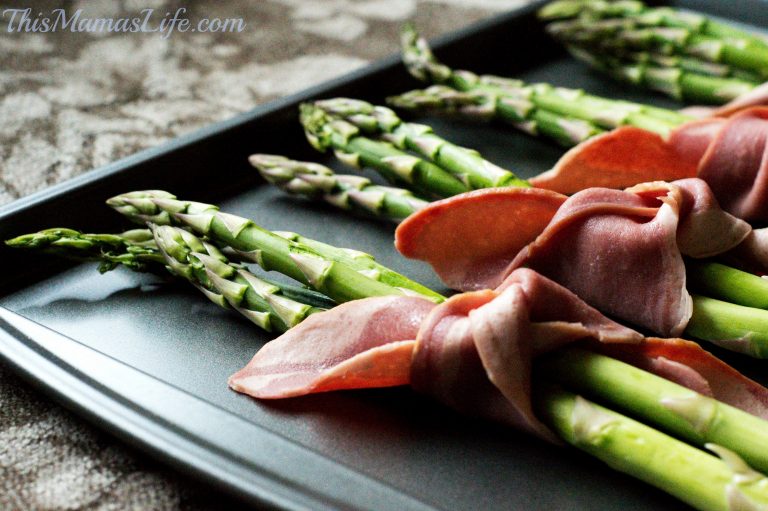
Where is `rug`? The height and width of the screenshot is (511, 768). rug is located at coordinates (68, 85).